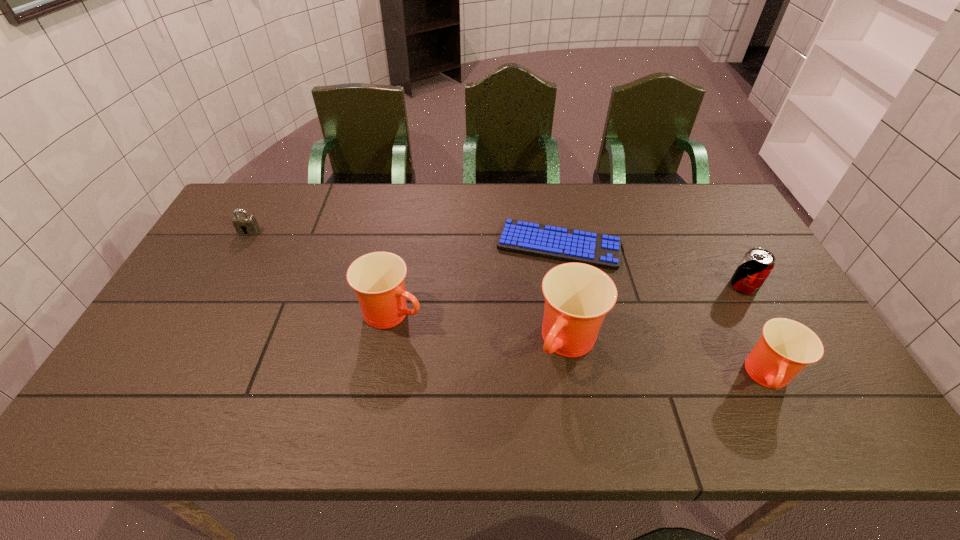
Identify the location of free area in between the padlock and the second object from left to right. (321, 272).

In order to click on empty location between the padlock and the computer keyboard in this screenshot , I will do `click(404, 239)`.

Point out which object is positioned as the third nearest to the rightmost cup. Please provide its 2D coordinates. Your answer should be formatted as a tuple, i.e. [(x, y)], where the tuple contains the x and y coordinates of a point satisfying the conditions above.

[(599, 250)]

What are the coordinates of `object identified as the second closest to the computer keyboard` in the screenshot? It's located at (377, 278).

Select which cup is the closest to the soda can. Please provide its 2D coordinates. Your answer should be formatted as a tuple, i.e. [(x, y)], where the tuple contains the x and y coordinates of a point satisfying the conditions above.

[(786, 347)]

In order to click on the third closest cup to the soda can in this screenshot , I will do `click(377, 278)`.

What are the coordinates of `free spot that satisfies the following two spatial constraints: 1. on the back side of the soda can; 2. on the right side of the rightmost cup` in the screenshot? It's located at (722, 286).

The width and height of the screenshot is (960, 540). I want to click on vacant region that satisfies the following two spatial constraints: 1. at the front of the second shortest cup near the keyhole; 2. on the right side of the leftmost object, so click(x=204, y=313).

Locate an element on the screen. The height and width of the screenshot is (540, 960). free space that satisfies the following two spatial constraints: 1. at the front of the fifth tallest object near the keyhole; 2. on the right side of the shortest cup is located at coordinates (168, 377).